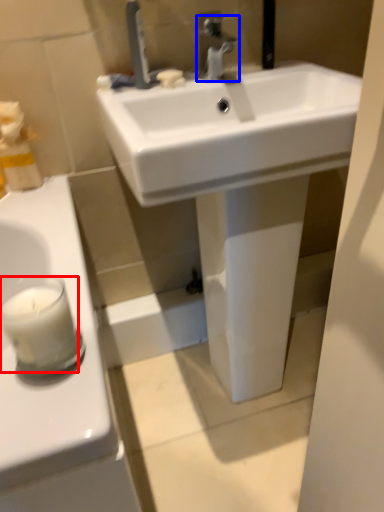
Question: Which object is further to the camera taking this photo, candle (highlighted by a red box) or tap (highlighted by a blue box)?

Choices:
 (A) candle
 (B) tap

Answer: (B)